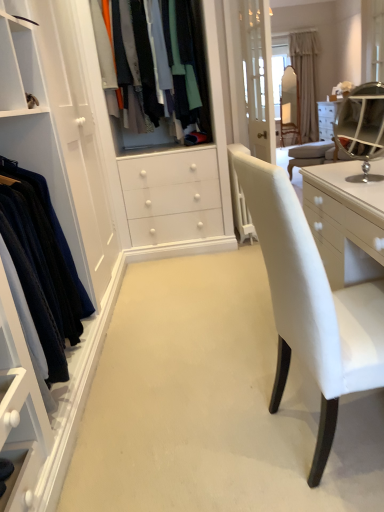
Question: Is there a large distance between beige fabric curtain at upper center and velvet blue sweater at left, the 2th clothing in the back-to-front sequence?

Choices:
 (A) yes
 (B) no

Answer: (A)

Question: From the image's perspective, is beige fabric curtain at upper center below velvet blue sweater at left, the second clothing positioned from the top?

Choices:
 (A) yes
 (B) no

Answer: (B)

Question: Can velvet blue sweater at left, the 2th clothing in the back-to-front sequence, be found inside beige fabric curtain at upper center?

Choices:
 (A) no
 (B) yes

Answer: (A)

Question: From the image's perspective, is beige fabric curtain at upper center over velvet blue sweater at left, the second clothing positioned from the top?

Choices:
 (A) no
 (B) yes

Answer: (B)

Question: Is the surface of beige fabric curtain at upper center in direct contact with velvet blue sweater at left, the 2th clothing in the back-to-front sequence?

Choices:
 (A) yes
 (B) no

Answer: (B)

Question: Is beige fabric curtain at upper center shorter than velvet blue sweater at left, the 2th clothing in the back-to-front sequence?

Choices:
 (A) yes
 (B) no

Answer: (B)

Question: Is silver/metallic vanity mirror at upper right bigger than velvet blue sweater at left, which ranks as the 1th clothing in bottom-to-top order?

Choices:
 (A) yes
 (B) no

Answer: (B)

Question: Does silver/metallic vanity mirror at upper right appear on the right side of velvet blue sweater at left, the 2th clothing in the back-to-front sequence?

Choices:
 (A) yes
 (B) no

Answer: (A)

Question: Is silver/metallic vanity mirror at upper right closer to the viewer compared to velvet blue sweater at left, the second clothing positioned from the top?

Choices:
 (A) no
 (B) yes

Answer: (A)

Question: Is velvet blue sweater at left, which ranks as the 1th clothing in bottom-to-top order, at the back of silver/metallic vanity mirror at upper right?

Choices:
 (A) no
 (B) yes

Answer: (A)

Question: Is silver/metallic vanity mirror at upper right taller than velvet blue sweater at left, the 2th clothing in the back-to-front sequence?

Choices:
 (A) yes
 (B) no

Answer: (B)

Question: Is silver/metallic vanity mirror at upper right to the left of velvet blue sweater at left, the second clothing positioned from the top, from the viewer's perspective?

Choices:
 (A) yes
 (B) no

Answer: (B)

Question: Is velvet blue sweater at left, which ranks as the 1th clothing in bottom-to-top order, with matte fabric shirts at center, arranged as the 1th clothing when viewed from the top?

Choices:
 (A) no
 (B) yes

Answer: (A)